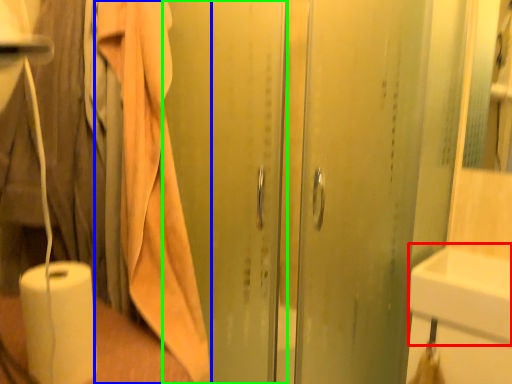
Question: Estimate the real-world distances between objects in this image. Which object is farther from sink (highlighted by a red box), bath towel (highlighted by a blue box) or screen door (highlighted by a green box)?

Choices:
 (A) bath towel
 (B) screen door

Answer: (A)